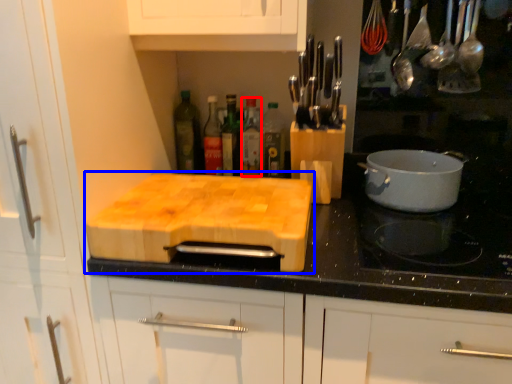
Question: Which point is further to the camera, bottle (highlighted by a red box) or cutting board (highlighted by a blue box)?

Choices:
 (A) bottle
 (B) cutting board

Answer: (A)